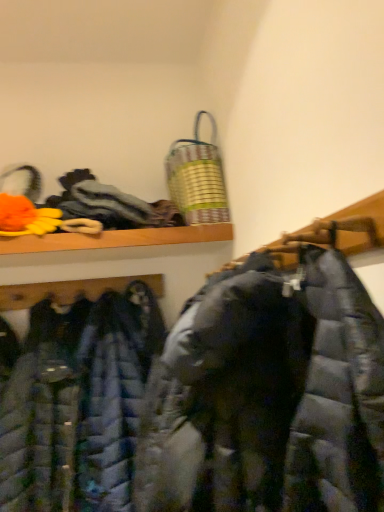
Question: In the image, is matte black puffer jacket at center, which appears as the second jacket when viewed from the back, positioned in front of or behind matte black puffer coat at center, the 1th cloak ordered from the bottom?

Choices:
 (A) behind
 (B) front

Answer: (B)

Question: Is matte black puffer jacket at center, which appears as the first jacket when viewed from the front, wider or thinner than matte black puffer coat at center, which is the 2th cloak from top to bottom?

Choices:
 (A) wide
 (B) thin

Answer: (A)

Question: Which of these objects is positioned closest to the matte black puffer jacket at center, which appears as the first jacket when viewed from the front?

Choices:
 (A) matte blue puffer jacket at center, the 1th jacket in the back-to-front sequence
 (B) metallic striped laundry basket at upper center
 (C) matte black puffer coat at center, the 1th cloak ordered from the bottom
 (D) textured gray cloth at upper left, arranged as the second cloak when ordered from the bottom

Answer: (A)

Question: Considering the real-world distances, which object is farthest from the matte black puffer coat at center, the 1th cloak ordered from the bottom?

Choices:
 (A) matte black puffer jacket at center, which appears as the second jacket when viewed from the back
 (B) metallic striped laundry basket at upper center
 (C) matte blue puffer jacket at center, placed as the second jacket when sorted from front to back
 (D) textured gray cloth at upper left, which is the first cloak in top-to-bottom order

Answer: (D)